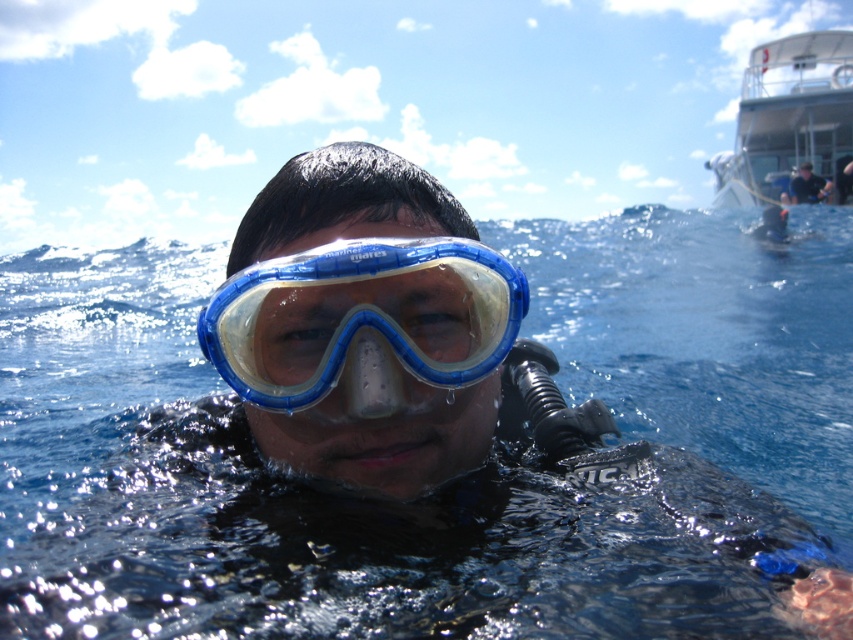
Consider the image. You are a swimmer trying to locate the largest object in the image. Which object should you focus on between the transparent blue water at center and the dark blue fabric shirt at upper right?

The transparent blue water at center is bigger than the dark blue fabric shirt at upper right, so you should focus on the transparent blue water at center.

Based on the photo, you are a photographer trying to capture a clear shot of the transparent plastic goggles at center and the dark blue fabric shirt at upper right. Since you want both objects in focus, which one should you adjust your camera focus on first to ensure the goggles are sharp?

The transparent plastic goggles at center is closer to the viewer than the dark blue fabric shirt at upper right. To ensure both are in focus, you should focus on the transparent plastic goggles at center first, as it is the closer object.